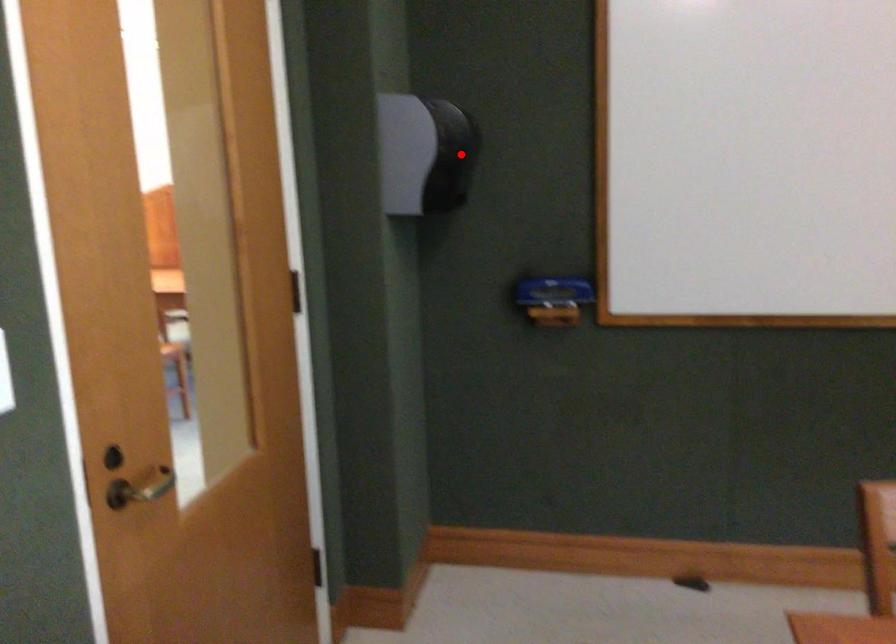
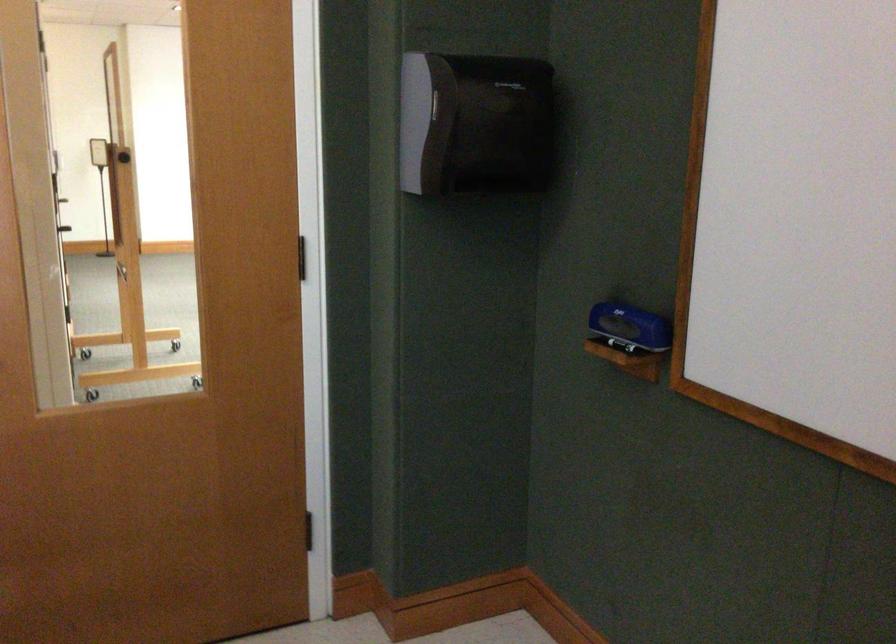
Question: I am providing you with two images of the same scene from different viewpoints. In image1, a red point is highlighted. Considering the same 3D point in image2, which of the following is correct?

Choices:
 (A) It is closer
 (B) It is farther

Answer: (A)